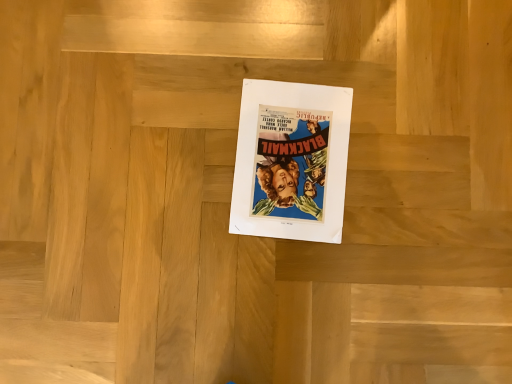
The height and width of the screenshot is (384, 512). I want to click on free space in front of matte paper poster at center, so click(267, 287).